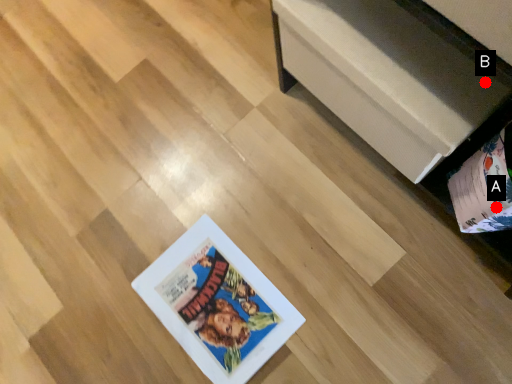
Question: Two points are circled on the image, labeled by A and B beside each circle. Which point appears farthest from the camera in this image?

Choices:
 (A) A is further
 (B) B is further

Answer: (A)